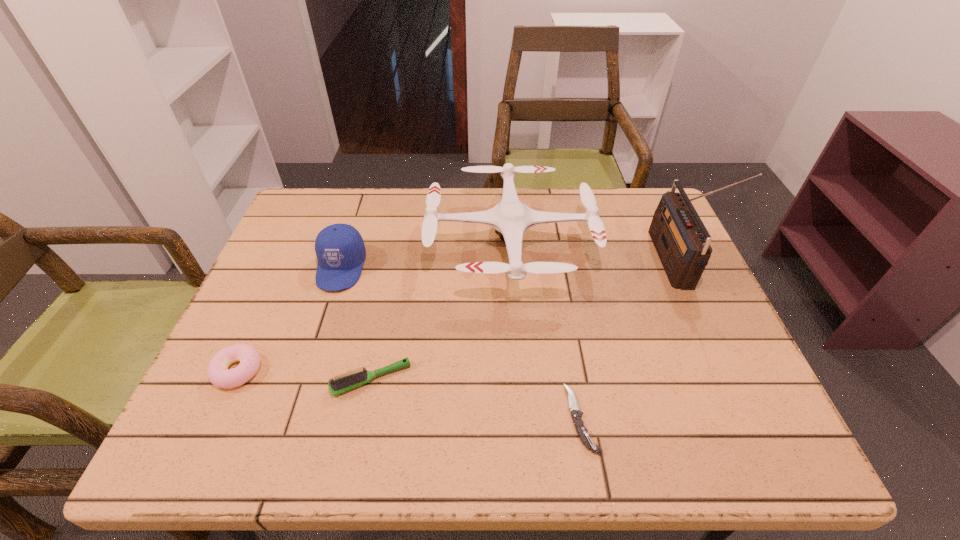
Locate an element on the screen. This screenshot has width=960, height=540. cap located in the left edge section of the desktop is located at coordinates (340, 250).

In order to click on doughnut that is at the left edge in this screenshot , I will do `click(218, 373)`.

Locate an element on the screen. The image size is (960, 540). object that is at the right edge is located at coordinates tap(682, 242).

Find the location of a particular element. This screenshot has height=540, width=960. object that is at the far right corner is located at coordinates (682, 242).

The height and width of the screenshot is (540, 960). In the image, there is a desktop. Find the location of `free space at the far edge`. free space at the far edge is located at coordinates (x=599, y=197).

Locate an element on the screen. The image size is (960, 540). free spot at the near edge of the desktop is located at coordinates (387, 440).

Find the location of a particular element. Image resolution: width=960 pixels, height=540 pixels. vacant space at the left edge of the desktop is located at coordinates (286, 356).

In the image, there is a desktop. Where is `vacant space at the right edge`? This screenshot has height=540, width=960. vacant space at the right edge is located at coordinates tap(658, 289).

In the image, there is a desktop. Identify the location of free space at the far left corner. The height and width of the screenshot is (540, 960). (352, 192).

This screenshot has height=540, width=960. In the image, there is a desktop. Identify the location of vacant space at the far right corner. (617, 188).